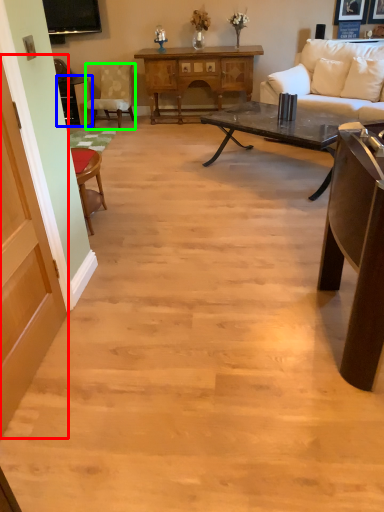
Question: Based on their relative distances, which object is farther from glass door (highlighted by a red box)? Choose from table (highlighted by a blue box) and chair (highlighted by a green box).

Choices:
 (A) table
 (B) chair

Answer: (B)